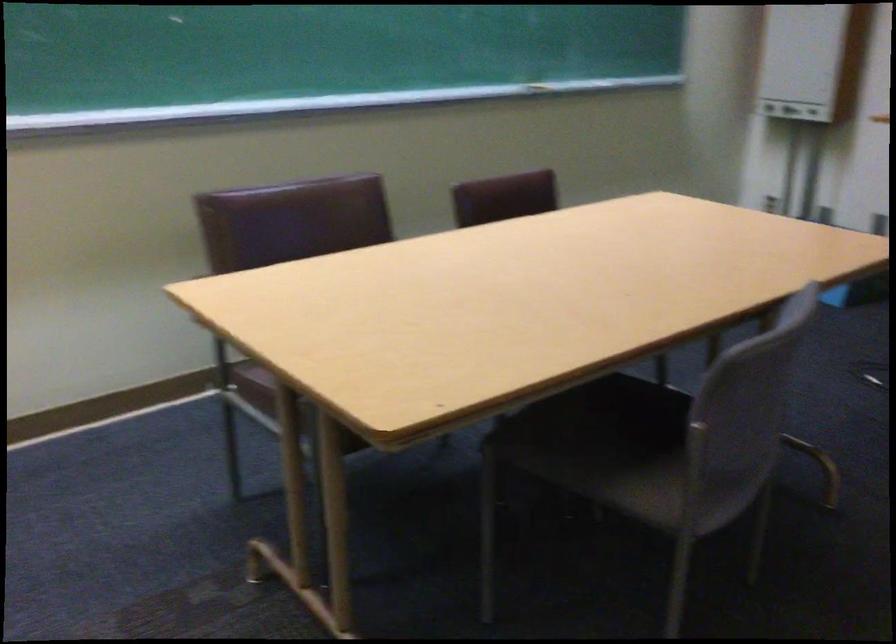
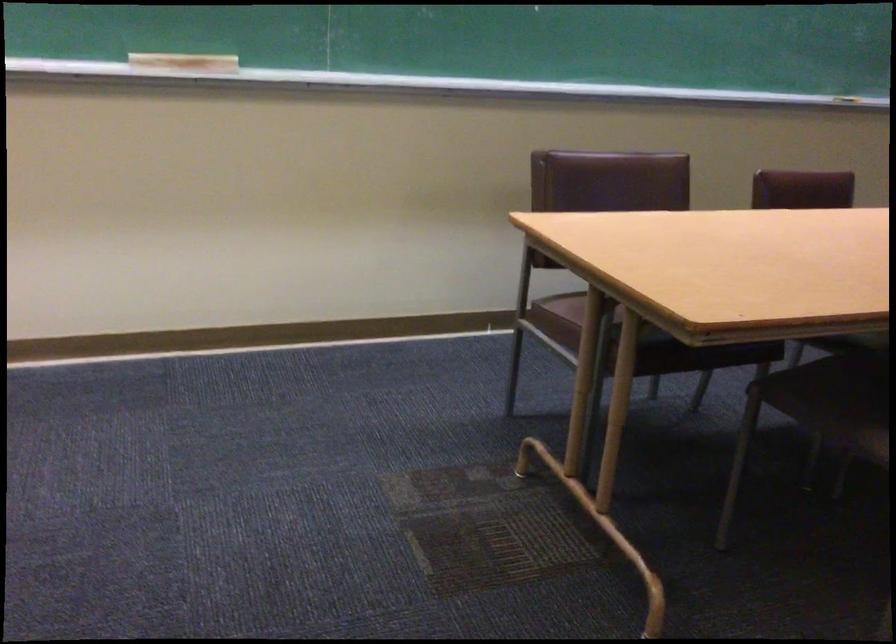
Question: In a continuous first-person perspective shot, in which direction is the camera moving?

Choices:
 (A) Left
 (B) Right
 (C) Forward
 (D) Backward

Answer: (D)